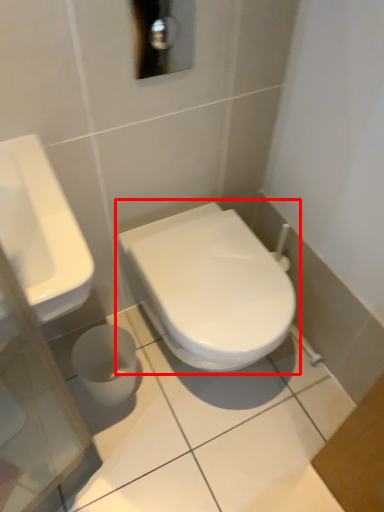
Question: From the image's perspective, what is the correct spatial relationship of toilet (annotated by the red box) in relation to sink?

Choices:
 (A) above
 (B) below

Answer: (B)